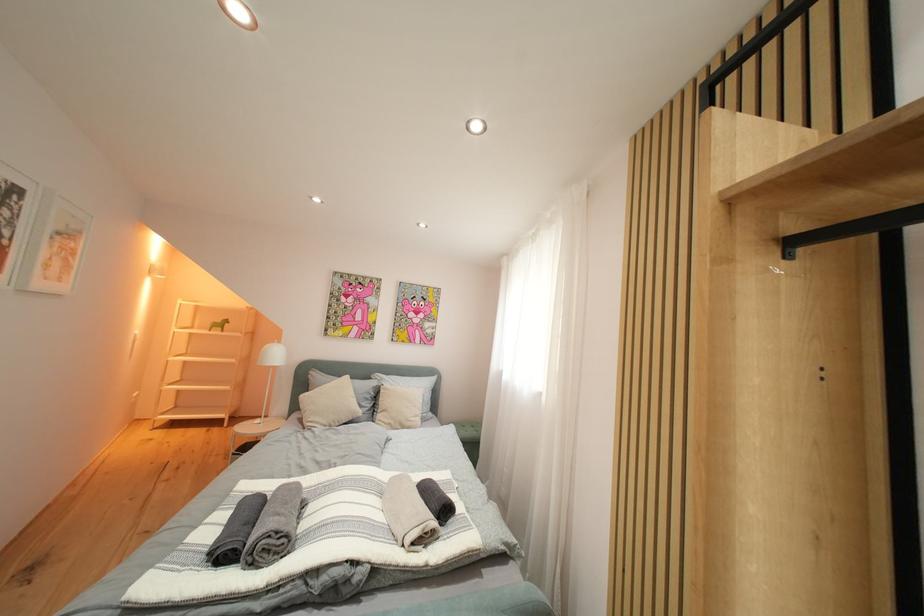
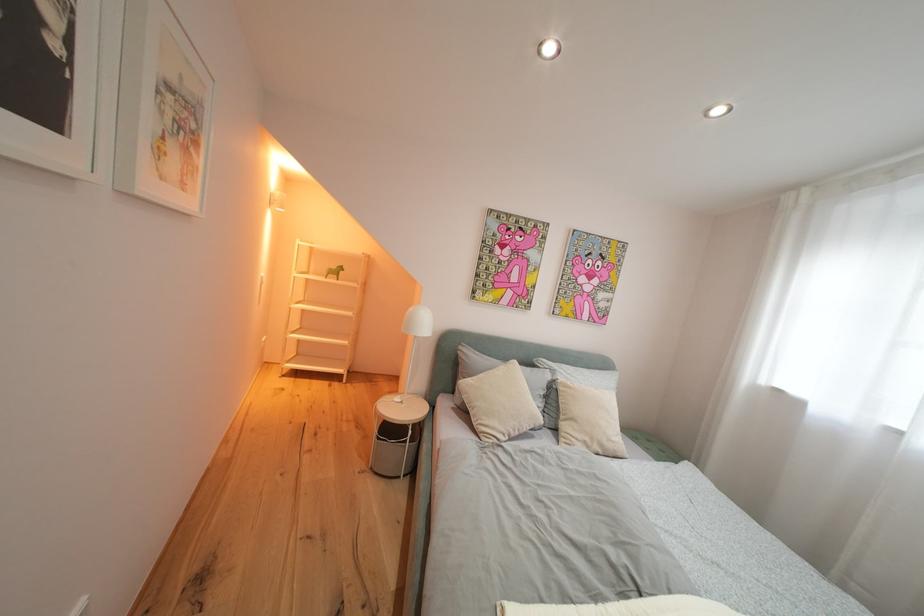
In a continuous first-person perspective shot, in which direction is the camera moving?

The movement direction of the cameraman is left, forward.